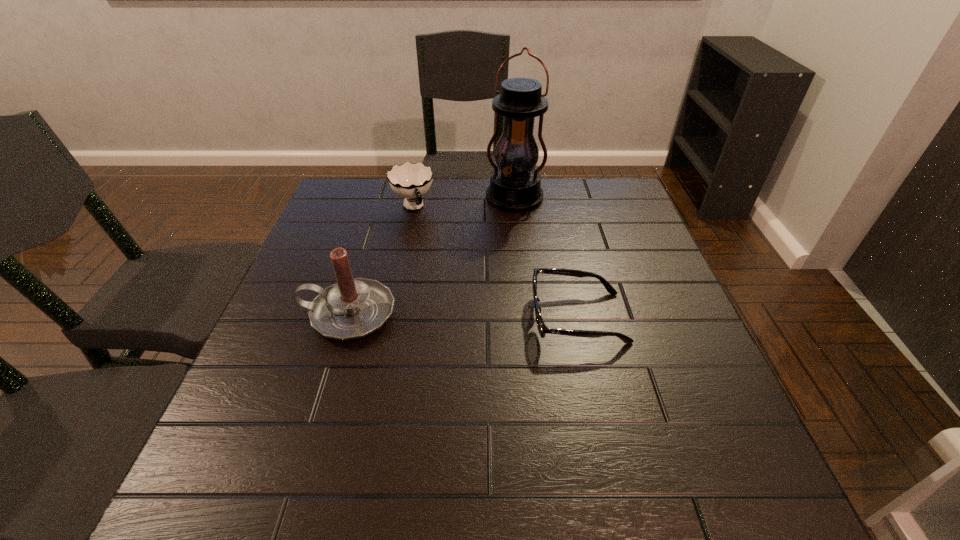
You are a GUI agent. You are given a task and a screenshot of the screen. Output one action in this format:
    pyautogui.click(x=<x>, y=<y>)
    Task: Click on the vacant region at the right edge of the desktop
    The width and height of the screenshot is (960, 540).
    Given the screenshot: What is the action you would take?
    pyautogui.click(x=675, y=313)

The height and width of the screenshot is (540, 960). In the image, there is a desktop. In order to click on free space at the far left corner in this screenshot , I will do `click(357, 205)`.

In the image, there is a desktop. Find the location of `vacant space at the near left corner`. vacant space at the near left corner is located at coordinates (222, 446).

Locate an element on the screen. This screenshot has height=540, width=960. free space at the far right corner is located at coordinates (622, 208).

The height and width of the screenshot is (540, 960). Identify the location of vacant area that lies between the tallest object and the shortest object. (546, 258).

The height and width of the screenshot is (540, 960). I want to click on free spot between the lantern and the cup, so click(464, 203).

Locate an element on the screen. The width and height of the screenshot is (960, 540). free space between the lantern and the spectacles is located at coordinates (546, 258).

Locate an element on the screen. The width and height of the screenshot is (960, 540). unoccupied position between the cup and the second tallest object is located at coordinates (381, 261).

Identify the location of free space that is in between the cup and the tallest object. (464, 203).

Image resolution: width=960 pixels, height=540 pixels. Find the location of `vacant space that's between the spectacles and the cup`. vacant space that's between the spectacles and the cup is located at coordinates (495, 263).